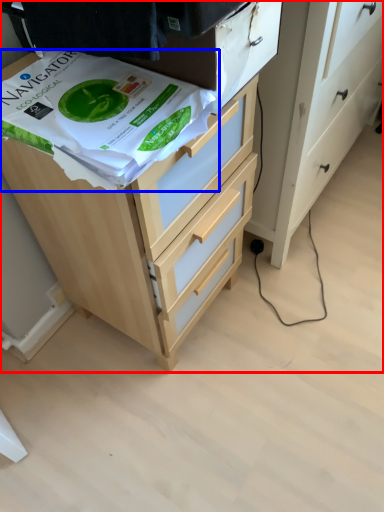
Question: Which point is further to the camera, chest of drawers (highlighted by a red box) or wrapping paper (highlighted by a blue box)?

Choices:
 (A) chest of drawers
 (B) wrapping paper

Answer: (A)